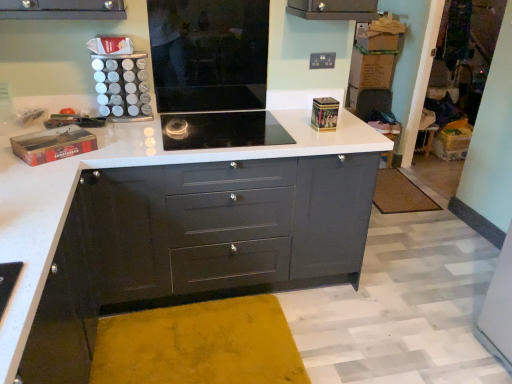
Question: Is point (154, 39) positioned closer to the camera than point (161, 119)?

Choices:
 (A) closer
 (B) farther

Answer: (A)

Question: Looking at the image, does black glass cooktop at center seem bigger or smaller compared to black glass cooktop at center?

Choices:
 (A) small
 (B) big

Answer: (B)

Question: Which object is the farthest from the brown textured mat at lower right?

Choices:
 (A) matte black chest of drawers at center
 (B) black glass cooktop at center
 (C) black glass cooktop at center

Answer: (C)

Question: Considering the real-world distances, which object is farthest from the black glass cooktop at center?

Choices:
 (A) black glass cooktop at center
 (B) matte black chest of drawers at center
 (C) brown textured mat at lower right

Answer: (C)